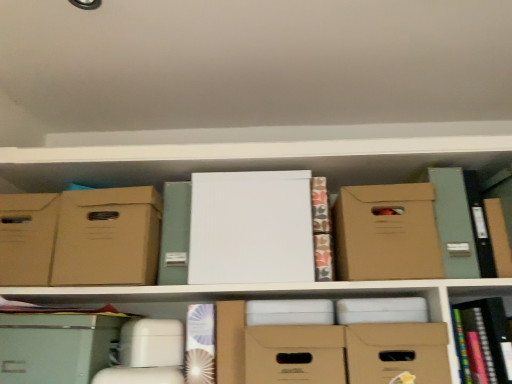
Question: Does white paper at center, the 1th paperback book in the left-to-right sequence, appear on the right side of matte cardboard box at center, arranged as the 3th storage box when viewed from the left?

Choices:
 (A) no
 (B) yes

Answer: (A)

Question: Can you confirm if white paper at center, the second paperback book positioned from the right, is bigger than matte cardboard box at center, arranged as the 3th storage box when viewed from the left?

Choices:
 (A) no
 (B) yes

Answer: (A)

Question: Is the position of white paper at center, the second paperback book positioned from the right, less distant than that of matte cardboard box at center, the second storage box in the right-to-left sequence?

Choices:
 (A) yes
 (B) no

Answer: (B)

Question: Is matte cardboard box at center, the second storage box in the right-to-left sequence, located within white paper at center, the 1th paperback book in the left-to-right sequence?

Choices:
 (A) no
 (B) yes

Answer: (A)

Question: Considering the relative sizes of white paper at center, the second paperback book positioned from the right, and matte cardboard box at center, the second storage box in the right-to-left sequence, in the image provided, is white paper at center, the second paperback book positioned from the right, smaller than matte cardboard box at center, the second storage box in the right-to-left sequence,?

Choices:
 (A) yes
 (B) no

Answer: (A)

Question: Can you confirm if white paper at center, the second paperback book positioned from the right, is positioned to the left of matte cardboard box at center, arranged as the 3th storage box when viewed from the left?

Choices:
 (A) yes
 (B) no

Answer: (A)

Question: Does multicolored hardcover book at lower right, which is the 2th book from left to right, lie behind white matte paper at center, placed as the 1th paperback book when sorted from right to left?

Choices:
 (A) no
 (B) yes

Answer: (A)

Question: From the image's perspective, is multicolored hardcover book at lower right, which is the 2th book from left to right, below white matte paper at center, placed as the 1th paperback book when sorted from right to left?

Choices:
 (A) yes
 (B) no

Answer: (A)

Question: Is multicolored hardcover book at lower right, which is the 2th book from left to right, positioned beyond the bounds of white matte paper at center, the 2th paperback book in the left-to-right sequence?

Choices:
 (A) yes
 (B) no

Answer: (A)

Question: Can you confirm if multicolored hardcover book at lower right, the first book from the right, is smaller than white matte paper at center, the 2th paperback book in the left-to-right sequence?

Choices:
 (A) no
 (B) yes

Answer: (B)

Question: Could you tell me if multicolored hardcover book at lower right, which is the 2th book from left to right, is facing white matte paper at center, the 2th paperback book in the left-to-right sequence?

Choices:
 (A) yes
 (B) no

Answer: (B)

Question: Does multicolored hardcover book at lower right, the first book from the right, lie in front of white matte paper at center, the 2th paperback book in the left-to-right sequence?

Choices:
 (A) yes
 (B) no

Answer: (A)

Question: Is white paper at center, the 1th book positioned from the left, oriented away from matte cardboard box at center, arranged as the 3th storage box when viewed from the left?

Choices:
 (A) no
 (B) yes

Answer: (A)